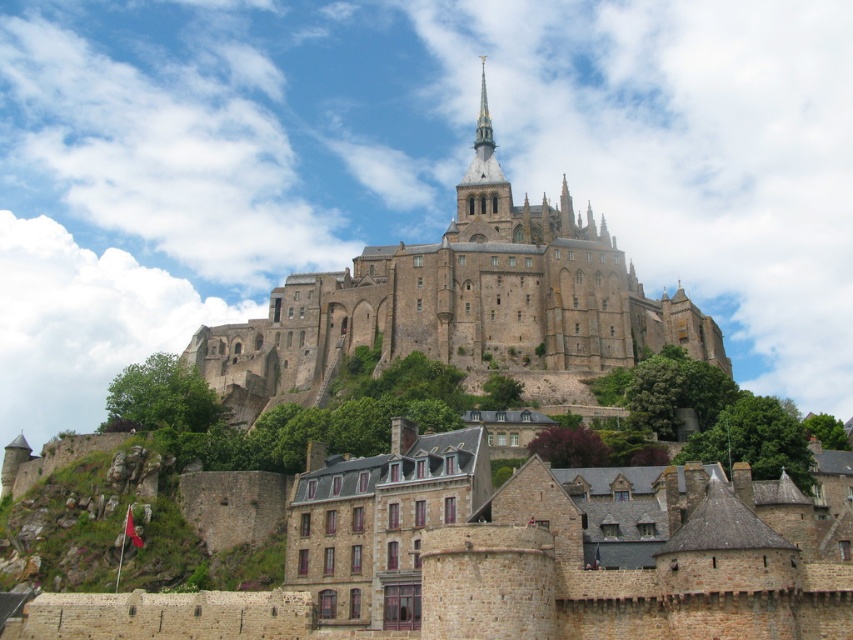
You are a tourist standing at the base of Mont Saint Michel and want to take a photo of the stone castle at center and the smooth stone spire at upper center. Which object should you point your camera upwards to capture?

You should point your camera upwards to capture the smooth stone spire at upper center because it is located above the stone castle at center.

Consider the image. You are a tourist standing at the base of Mont Saint Michel and want to take a photo that includes both the stone castle at center and the smooth stone spire at upper center. Which object should you position closer to the edge of your camera frame to ensure both are fully visible?

The stone castle at center might be wider than the smooth stone spire at upper center, so you should position the stone castle at center closer to the edge of your camera frame to ensure both are fully visible.